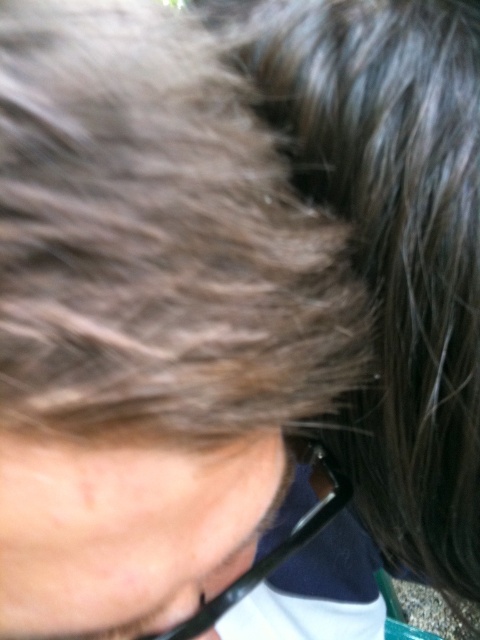
Does dark brown hair at upper right have a smaller size compared to black plastic glasses at lower center?

No.

Can you confirm if dark brown hair at upper right is thinner than black plastic glasses at lower center?

No.

Locate an element on the screen. dark brown hair at upper right is located at coordinates (393, 244).